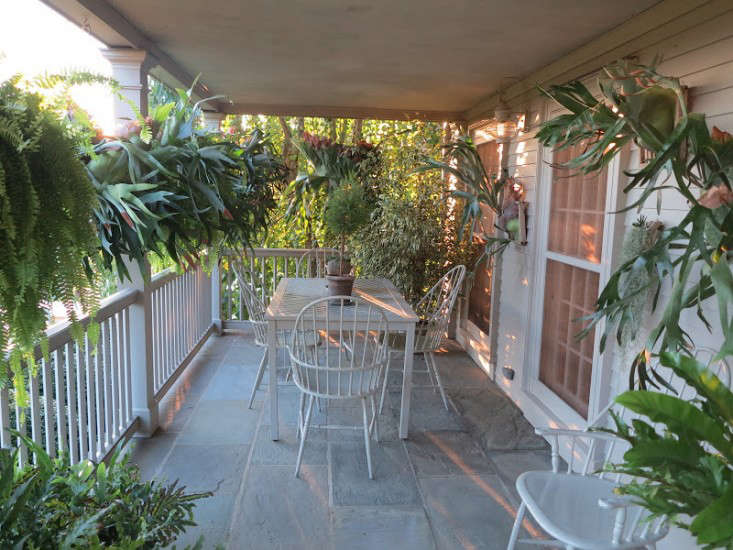
Find the location of `door`. door is located at coordinates (580, 276).